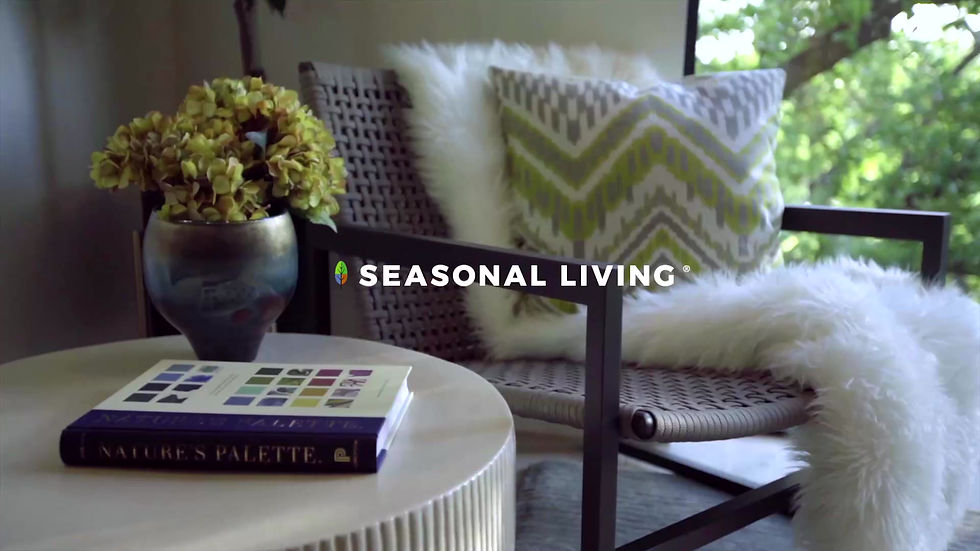
Locate an element on the screen. Image resolution: width=980 pixels, height=551 pixels. throw blanket is located at coordinates (466, 140).